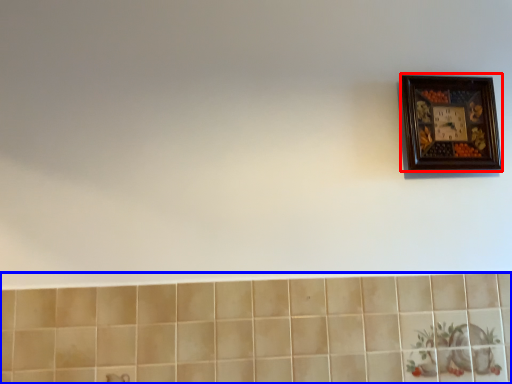
Question: Which object appears closest to the camera in this image, picture frame (highlighted by a red box) or ceramic tile (highlighted by a blue box)?

Choices:
 (A) picture frame
 (B) ceramic tile

Answer: (B)